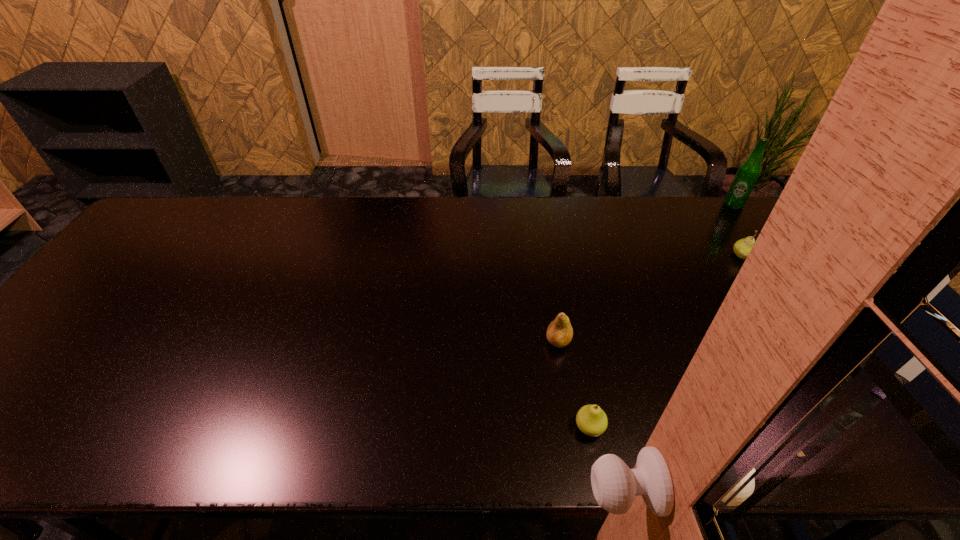
In order to click on object that is at the far edge in this screenshot , I will do pos(748,172).

At what (x,y) coordinates should I click in order to perform the action: click on object that is at the near edge. Please return your answer as a coordinate pair (x, y). This screenshot has height=540, width=960. Looking at the image, I should click on (591, 420).

Find the location of `vacant area at the far edge`. vacant area at the far edge is located at coordinates (319, 224).

This screenshot has width=960, height=540. In the image, there is a desktop. What are the coordinates of `free region at the near edge` in the screenshot? It's located at (769, 428).

In the image, there is a desktop. What are the coordinates of `vacant space at the right edge` in the screenshot? It's located at (781, 251).

Identify the location of vacant space at the far right corner of the desktop. The width and height of the screenshot is (960, 540). (792, 227).

The image size is (960, 540). Find the location of `vacant space that is in between the rightmost object and the third farthest object`. vacant space that is in between the rightmost object and the third farthest object is located at coordinates (646, 273).

Identify the location of blank region between the nearest object and the second nearest pear. The image size is (960, 540). (574, 384).

This screenshot has width=960, height=540. I want to click on free area in between the rightmost object and the second nearest pear, so click(646, 273).

Find the location of a particular element. The width and height of the screenshot is (960, 540). unoccupied position between the second farthest pear and the nearest pear is located at coordinates (574, 384).